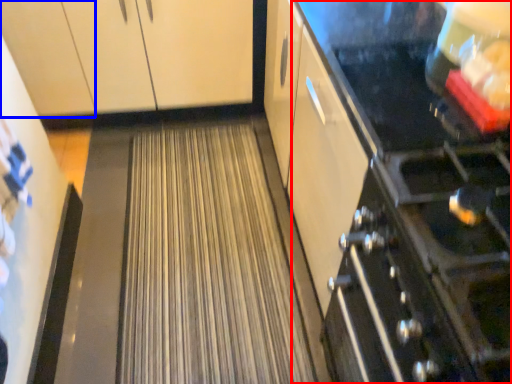
Question: Which object is closer to the camera taking this photo, appliance (highlighted by a red box) or cabinetry (highlighted by a blue box)?

Choices:
 (A) appliance
 (B) cabinetry

Answer: (A)